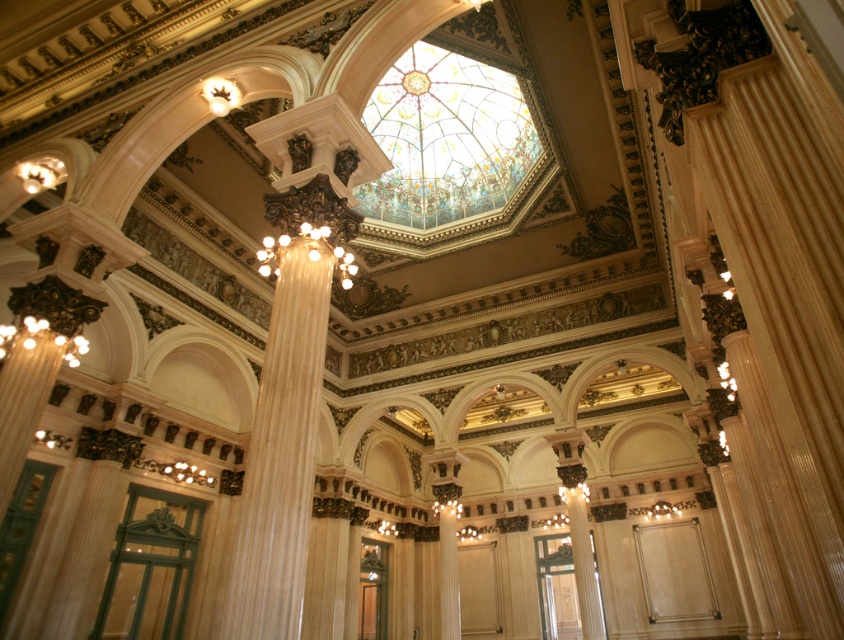
You are an event planner setting up a large chandelier in the hall. The new chandelier you want to install is 2 meters in diameter. The current matte gold chandelier at center is to be replaced. Considering the distance between the stained glass dome at center and the current chandelier, will the new chandelier fit without touching the dome?

The distance between the stained glass dome at center and the matte gold chandelier at center is 26.36 meters. Since the new chandelier is only 2 meters in diameter, there is ample space between them, so the new chandelier will fit without touching the dome.

You are standing in the ornately decorated hall and want to move from the point at coordinates point (x=439, y=548) to the point at coordinates point (x=274, y=262). According to the image, which direction should you move to reach your destination?

Since point (x=439, y=548) is behind point (x=274, y=262), you should move forward to reach point (x=274, y=262) from point (x=439, y=548).

You are standing in the ornately decorated hall and want to place a decorative item between the white glossy column at center and the matte gold chandelier at center. Based on their positions, which object should the item be closer to if it needs to be placed exactly halfway between them?

The item should be placed exactly halfway between the white glossy column at center and the matte gold chandelier at center. Since the white glossy column at center is to the left of the matte gold chandelier at center, the midpoint would be equidistant from both objects.